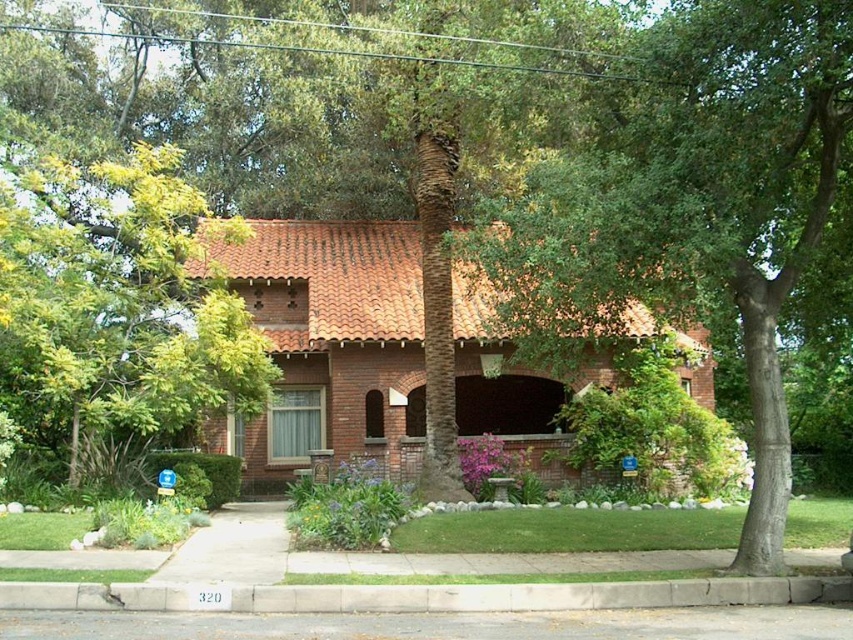
You are a gardener planning to plant a new shrub that requires a space of 1 meter in width. You see the green leafy tree at upper left and the gray concrete curb at lower center. Which location would allow the shrub to grow without overcrowding?

The green leafy tree at upper left might be wider than the gray concrete curb at lower center, so the gray concrete curb at lower center is likely narrower and may not provide enough space for the shrub to grow without overcrowding. Consider planting near the tree where there is more width available.